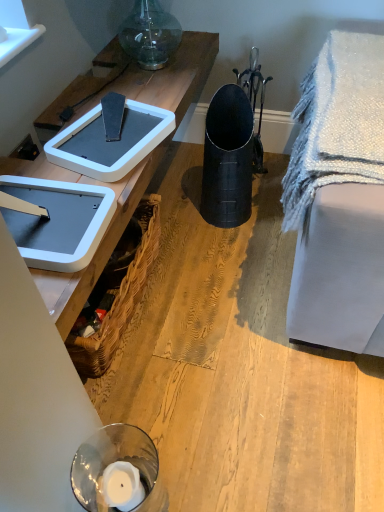
Question: In terms of width, does woven brown picnic basket at lower left look wider or thinner when compared to black matte trash bin/can at center?

Choices:
 (A) wide
 (B) thin

Answer: (B)

Question: Considering the positions of point (137, 203) and point (240, 212), is point (137, 203) closer or farther from the camera than point (240, 212)?

Choices:
 (A) closer
 (B) farther

Answer: (A)

Question: Which of these objects is positioned farthest from the matte black trash can at center?

Choices:
 (A) white plastic weight scale at upper left, the 2th weight scale viewed from the back
 (B) black matte trash bin/can at center
 (C) white textured blanket at right
 (D) woven brown picnic basket at lower left
 (E) white plastic weight scale at upper left, marked as the 1th weight scale in a back-to-front arrangement

Answer: (A)

Question: Which object is the farthest from the matte black trash can at center?

Choices:
 (A) white textured blanket at right
 (B) woven brown picnic basket at lower left
 (C) black matte trash bin/can at center
 (D) white plastic weight scale at upper left, marked as the 1th weight scale in a back-to-front arrangement
 (E) white plastic weight scale at upper left, positioned as the first weight scale in front-to-back order

Answer: (E)